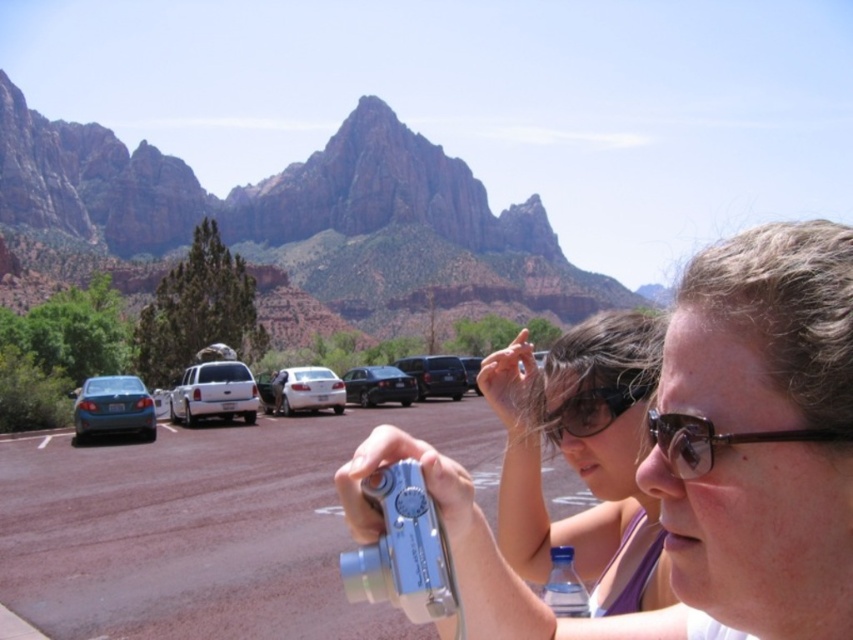
Is point (683, 596) positioned before point (467, 362)?

Yes, it is in front of point (467, 362).

Is metallic silver camera at center above metallic silver suv at center?

Correct, metallic silver camera at center is located above metallic silver suv at center.

This screenshot has height=640, width=853. Identify the location of metallic silver camera at center. (706, 458).

Does point (222, 371) lie in front of point (119, 392)?

That is False.

Is point (223, 387) behind point (129, 378)?

Yes, it is behind point (129, 378).

Locate an element on the screen. white matte suv at center is located at coordinates (213, 392).

Who is positioned more to the right, rustic rock formation at upper left or brown plastic glasses at center?

brown plastic glasses at center is more to the right.

Is rustic rock formation at upper left to the right of brown plastic glasses at center from the viewer's perspective?

No, rustic rock formation at upper left is not to the right of brown plastic glasses at center.

Who is more distant from viewer, (x=170, y=220) or (x=660, y=426)?

Positioned behind is point (x=170, y=220).

Identify the location of rustic rock formation at upper left. (299, 221).